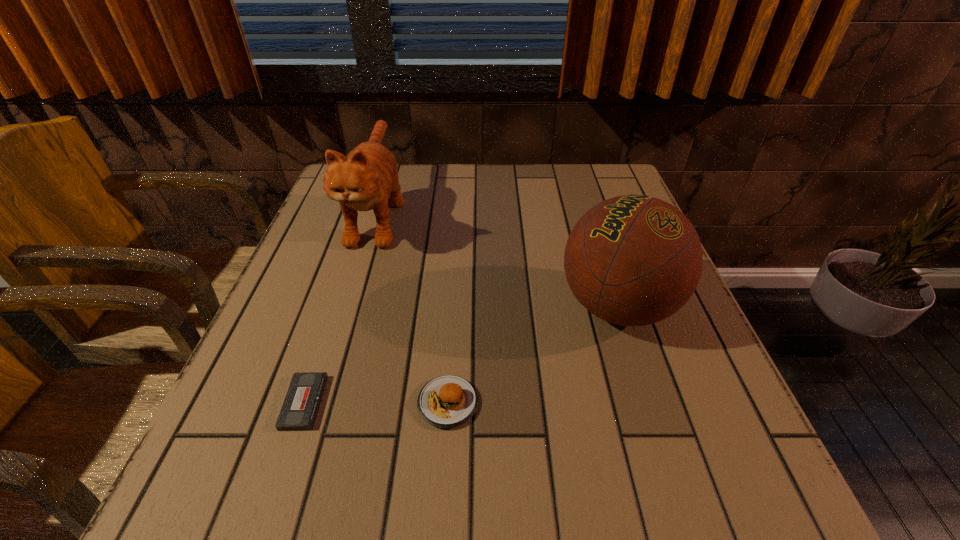
You are a GUI agent. You are given a task and a screenshot of the screen. Output one action in this format:
    pyautogui.click(x=<x>, y=<y>)
    Task: Click on the object that is at the far edge
    The width and height of the screenshot is (960, 540).
    Given the screenshot: What is the action you would take?
    pyautogui.click(x=362, y=181)

I want to click on cat at the left edge, so click(362, 181).

Where is `videotape that is at the left edge`? Image resolution: width=960 pixels, height=540 pixels. videotape that is at the left edge is located at coordinates (300, 408).

Locate an element on the screen. object that is at the right edge is located at coordinates (632, 260).

The height and width of the screenshot is (540, 960). What are the coordinates of `object that is at the far left corner` in the screenshot? It's located at (362, 181).

This screenshot has width=960, height=540. I want to click on vacant area at the far edge of the desktop, so click(526, 206).

Locate an element on the screen. Image resolution: width=960 pixels, height=540 pixels. vacant area at the near edge is located at coordinates (358, 523).

At what (x,y) coordinates should I click in order to perform the action: click on vacant space at the left edge of the desktop. Please return your answer as a coordinate pair (x, y). The width and height of the screenshot is (960, 540). Looking at the image, I should click on (269, 442).

In the image, there is a desktop. Where is `vacant space at the right edge`? vacant space at the right edge is located at coordinates (681, 310).

Where is `vacant space at the far right corner`? vacant space at the far right corner is located at coordinates 568,173.